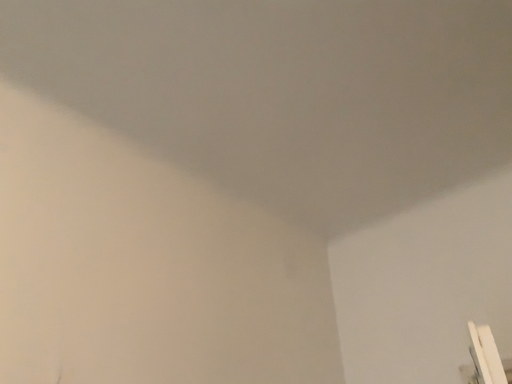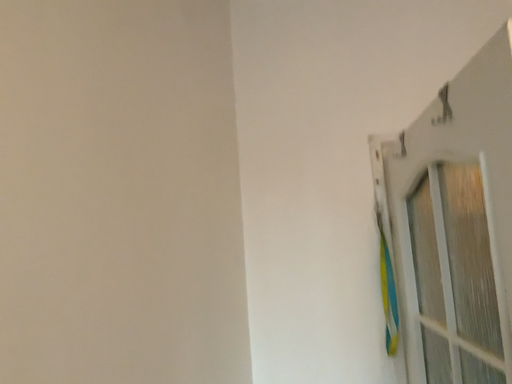
Question: How did the camera likely rotate when shooting the video?

Choices:
 (A) rotated right
 (B) rotated left

Answer: (A)